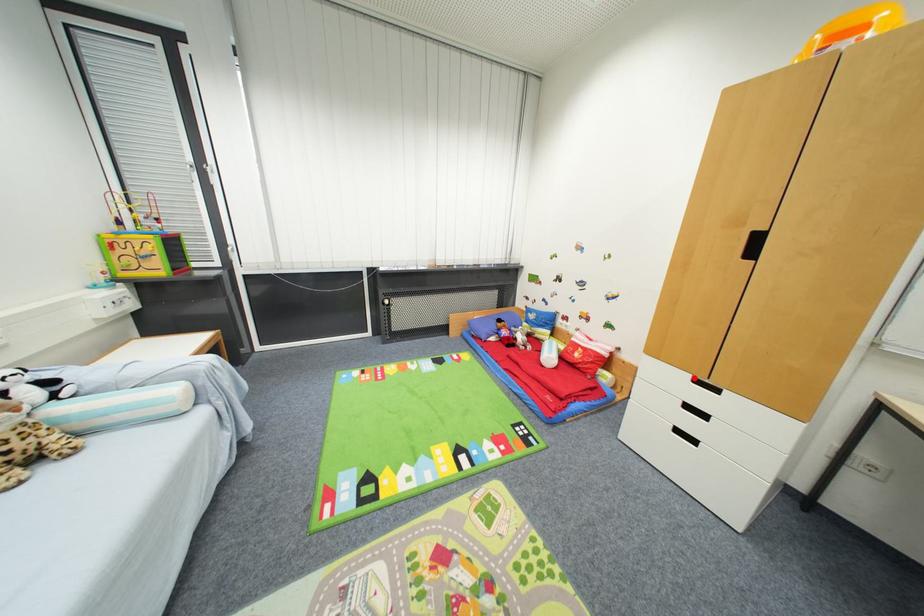
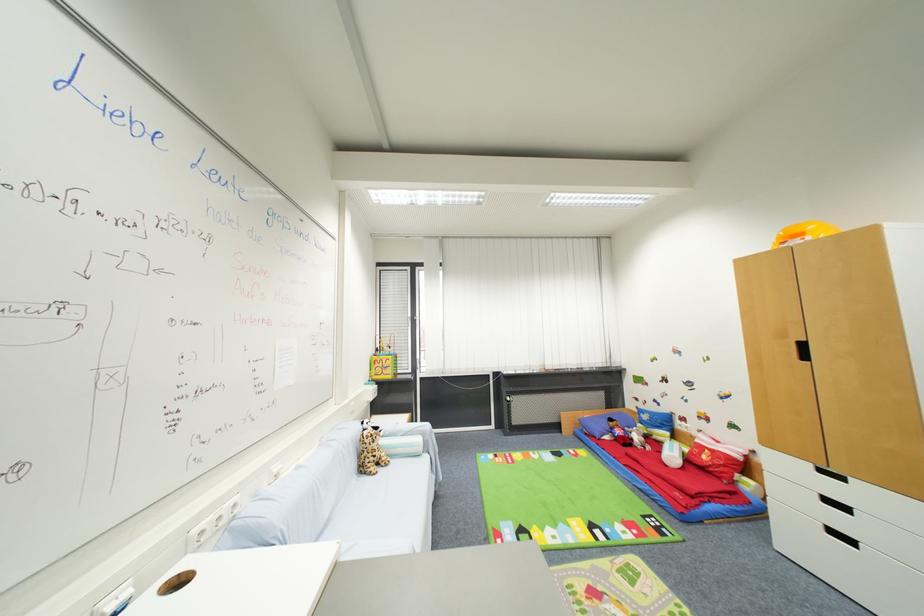
Question: I am providing you with two images of the same scene from different viewpoints. A red point is marked on the first image. At the location where the point appears in image 1, is it still visible in image 2?

Choices:
 (A) Yes
 (B) No

Answer: (A)